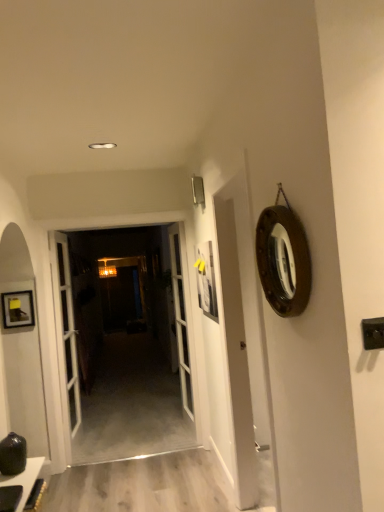
Where is `unoccupied area in front of white glass door at center, which appears as the 2th door when viewed from the right`? The height and width of the screenshot is (512, 384). unoccupied area in front of white glass door at center, which appears as the 2th door when viewed from the right is located at coordinates (150, 443).